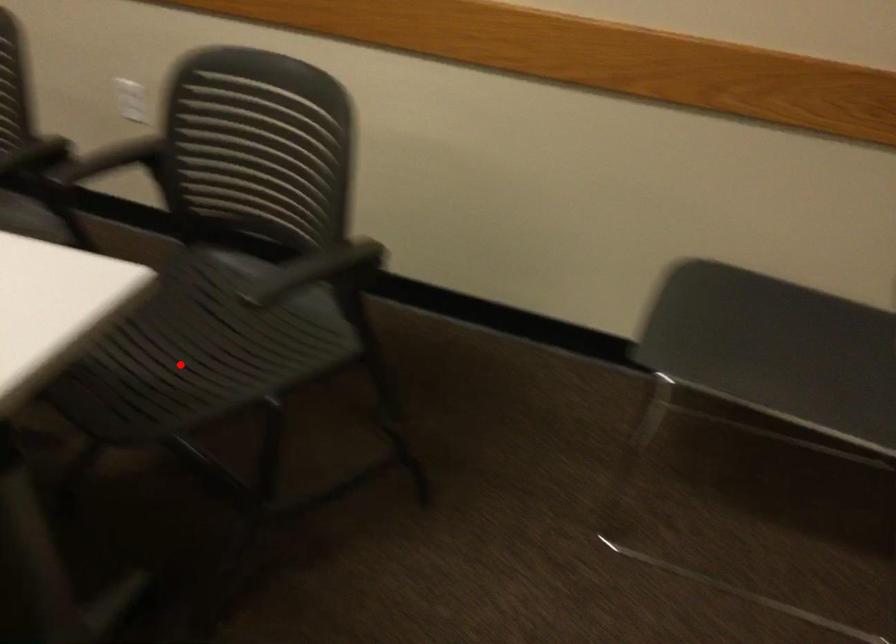
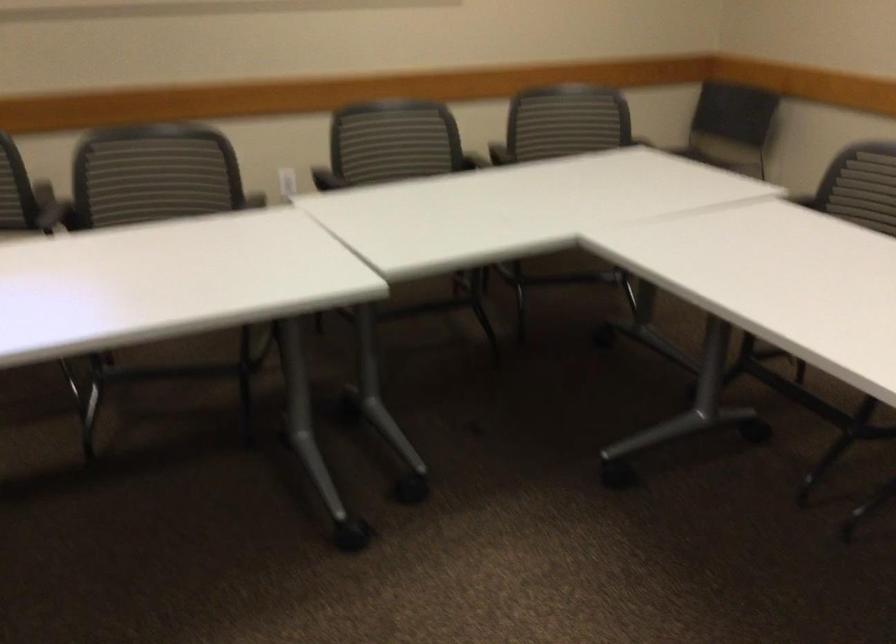
Question: I am providing you with two images of the same scene from different viewpoints. A red point is marked on the first image. At the location where the point appears in image 1, is it still visible in image 2?

Choices:
 (A) Yes
 (B) No

Answer: (B)